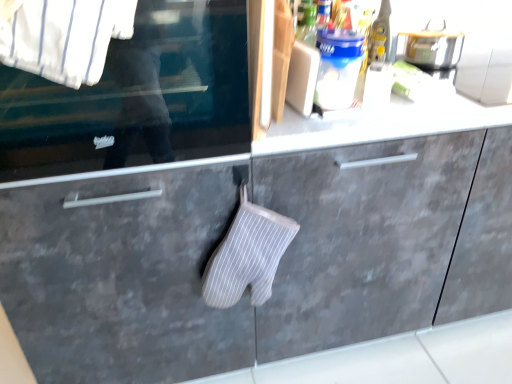
Question: Is transparent glass window at center facing towards white striped fabric at upper left?

Choices:
 (A) no
 (B) yes

Answer: (B)

Question: Is transparent glass window at center at the right side of white striped fabric at upper left?

Choices:
 (A) yes
 (B) no

Answer: (B)

Question: Can you confirm if transparent glass window at center is positioned to the left of white striped fabric at upper left?

Choices:
 (A) no
 (B) yes

Answer: (B)

Question: Is white striped fabric at upper left a part of transparent glass window at center?

Choices:
 (A) no
 (B) yes

Answer: (B)

Question: Is transparent glass window at center further to camera compared to white striped fabric at upper left?

Choices:
 (A) no
 (B) yes

Answer: (B)

Question: Is point (53, 13) closer or farther from the camera than point (227, 289)?

Choices:
 (A) closer
 (B) farther

Answer: (A)

Question: In terms of height, does white striped fabric at upper left look taller or shorter compared to white striped fabric oven mitt at center?

Choices:
 (A) tall
 (B) short

Answer: (B)

Question: Is white striped fabric at upper left wider or thinner than white striped fabric oven mitt at center?

Choices:
 (A) wide
 (B) thin

Answer: (A)

Question: From the image's perspective, relative to white striped fabric oven mitt at center, is white striped fabric at upper left above or below?

Choices:
 (A) below
 (B) above

Answer: (B)

Question: In the image, is white fabric oven mitt at center positioned in front of or behind gray matte drawer at lower left?

Choices:
 (A) front
 (B) behind

Answer: (B)

Question: In terms of height, does white fabric oven mitt at center look taller or shorter compared to gray matte drawer at lower left?

Choices:
 (A) short
 (B) tall

Answer: (A)

Question: In terms of size, does white fabric oven mitt at center appear bigger or smaller than gray matte drawer at lower left?

Choices:
 (A) big
 (B) small

Answer: (A)

Question: Does point (282, 261) appear closer or farther from the camera than point (185, 268)?

Choices:
 (A) farther
 (B) closer

Answer: (A)

Question: Is white striped fabric at upper left situated inside gray matte drawer at lower left or outside?

Choices:
 (A) outside
 (B) inside

Answer: (A)

Question: Is white striped fabric at upper left bigger or smaller than gray matte drawer at lower left?

Choices:
 (A) big
 (B) small

Answer: (B)